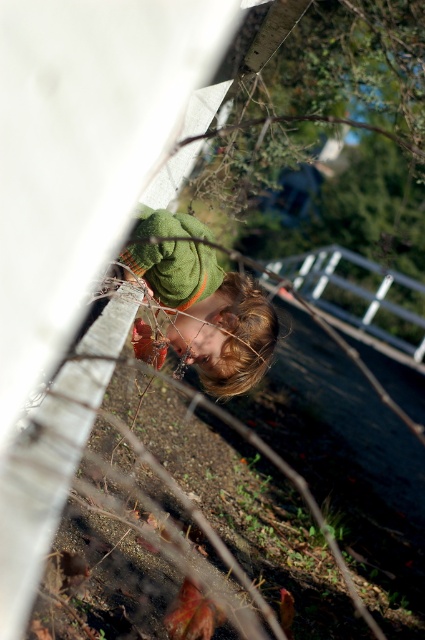
Question: Which point is farther from the camera taking this photo?

Choices:
 (A) (325, 273)
 (B) (223, 333)

Answer: (A)

Question: Is green knitted sweater at upper center positioned before metallic silver fence at center?

Choices:
 (A) yes
 (B) no

Answer: (A)

Question: From the image, what is the correct spatial relationship of green knitted sweater at upper center in relation to metallic silver fence at center?

Choices:
 (A) right
 (B) left

Answer: (B)

Question: Among these objects, which one is farthest from the camera?

Choices:
 (A) green knitted sweater at upper center
 (B) metallic silver fence at center

Answer: (B)

Question: Observing the image, what is the correct spatial positioning of green knitted sweater at upper center in reference to metallic silver fence at center?

Choices:
 (A) right
 (B) left

Answer: (B)

Question: Which point is closer to the camera?

Choices:
 (A) (382, 330)
 (B) (130, 276)

Answer: (B)